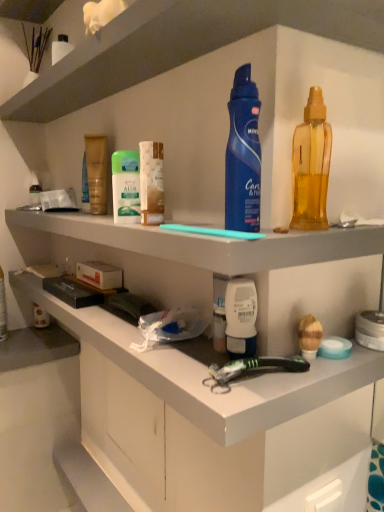
The image size is (384, 512). I want to click on vacant area located to the right-hand side of translucent plastic deodorant stick at center, which ranks as the third toiletry in left-to-right order, so [264, 227].